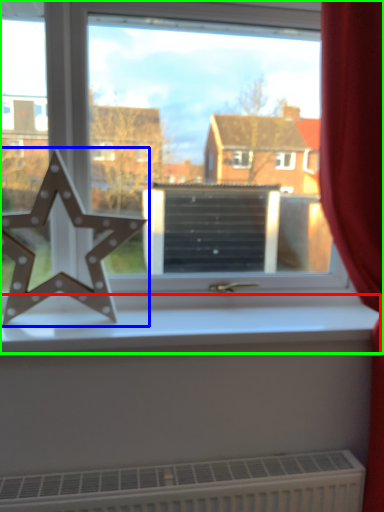
Question: Estimate the real-world distances between objects in this image. Which object is farther from window sill (highlighted by a red box), letter (highlighted by a blue box) or window (highlighted by a green box)?

Choices:
 (A) letter
 (B) window

Answer: (B)